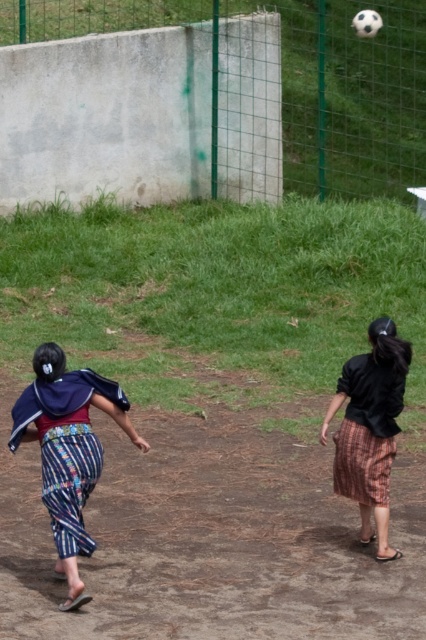
You are a soccer player trying to score a goal. You see two points on the field marked as point (x=65, y=396) and point (x=347, y=468). Which point is closer to you if you are facing the direction of the ball?

Point (x=65, y=396) is in front of point (x=347, y=468), so it is closer to you when facing the direction of the ball.

You are a photographer trying to capture a photo of the striped fabric pants at lower left and the black cotton shirt at center. Which one should you focus on first to ensure both are in focus?

You should focus on the striped fabric pants at lower left first since it is closer to the viewer than the black cotton shirt at center, allowing you to adjust focus for the farther object afterward.